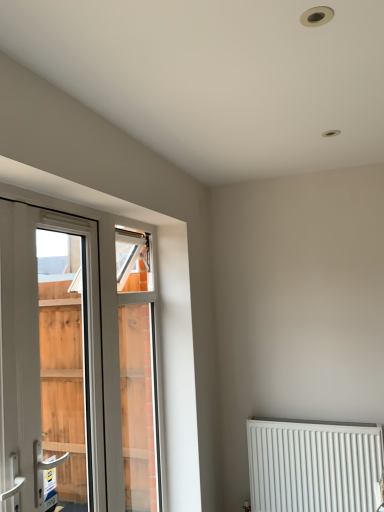
What do you see at coordinates (73, 368) in the screenshot? This screenshot has height=512, width=384. I see `white plastic window at left` at bounding box center [73, 368].

The image size is (384, 512). I want to click on white plastic window at left, so click(73, 368).

What is the approximate width of white plastic window at left?

The width of white plastic window at left is 4.58 inches.

What is the approximate width of white metal radiator at lower right?

white metal radiator at lower right is 5.27 inches wide.

Image resolution: width=384 pixels, height=512 pixels. In order to click on white metal radiator at lower right in this screenshot , I will do `click(313, 466)`.

Image resolution: width=384 pixels, height=512 pixels. What do you see at coordinates (313, 466) in the screenshot?
I see `white metal radiator at lower right` at bounding box center [313, 466].

What is the approximate height of white metal radiator at lower right?

26.43 inches.

The height and width of the screenshot is (512, 384). I want to click on white plastic window at left, so click(73, 368).

Which object is positioned more to the left, white metal radiator at lower right or white plastic window at left?

white plastic window at left is more to the left.

Is white metal radiator at lower right further to camera compared to white plastic window at left?

That is True.

Is point (260, 436) positioned in front of point (17, 372)?

That is False.

From the image's perspective, is white metal radiator at lower right located above white plastic window at left?

No, from the image's perspective, white metal radiator at lower right is not on top of white plastic window at left.

From a real-world perspective, is white metal radiator at lower right below white plastic window at left?

Indeed, from a real-world perspective, white metal radiator at lower right is positioned beneath white plastic window at left.

Considering the sizes of white metal radiator at lower right and white plastic window at left in the image, is white metal radiator at lower right wider or thinner than white plastic window at left?

In the image, white metal radiator at lower right appears to be wider than white plastic window at left.

Which of these two, white metal radiator at lower right or white plastic window at left, stands shorter?

With less height is white metal radiator at lower right.

In terms of size, does white metal radiator at lower right appear bigger or smaller than white plastic window at left?

Considering their sizes, white metal radiator at lower right takes up less space than white plastic window at left.

Which is correct: white metal radiator at lower right is inside white plastic window at left, or outside of it?

white metal radiator at lower right cannot be found inside white plastic window at left.

Is white metal radiator at lower right next to white plastic window at left and touching it?

No, white metal radiator at lower right is not beside white plastic window at left.

Does white metal radiator at lower right turn towards white plastic window at left?

No, white metal radiator at lower right is not turned towards white plastic window at left.

What are the coordinates of `radiator below the white plastic window at left (from a real-world perspective)` in the screenshot? It's located at (313, 466).

Is white plastic window at left to the right of white metal radiator at lower right from the viewer's perspective?

Incorrect, white plastic window at left is not on the right side of white metal radiator at lower right.

Considering the relative positions of white plastic window at left and white metal radiator at lower right in the image provided, is white plastic window at left behind white metal radiator at lower right?

No, white plastic window at left is closer to the viewer.

Which is nearer, (x=53, y=301) or (x=287, y=458)?

Point (x=53, y=301) is positioned farther from the camera compared to point (x=287, y=458).

From the image's perspective, which one is positioned higher, white plastic window at left or white metal radiator at lower right?

white plastic window at left appears higher in the image.

From a real-world perspective, is white plastic window at left below white metal radiator at lower right?

No, from a real-world perspective, white plastic window at left is not under white metal radiator at lower right.

Which object is thinner, white plastic window at left or white metal radiator at lower right?

Thinner between the two is white plastic window at left.

Can you confirm if white plastic window at left is taller than white metal radiator at lower right?

Yes.

Based on the photo, considering the sizes of white plastic window at left and white metal radiator at lower right in the image, is white plastic window at left bigger or smaller than white metal radiator at lower right?

Clearly, white plastic window at left is larger in size than white metal radiator at lower right.

Is white plastic window at left surrounding white metal radiator at lower right?

No, white metal radiator at lower right is located outside of white plastic window at left.

Is white plastic window at left not close to white metal radiator at lower right?

Absolutely, white plastic window at left is distant from white metal radiator at lower right.

Is white plastic window at left oriented away from white metal radiator at lower right?

That's not correct — white plastic window at left is not looking away from white metal radiator at lower right.

How different are the orientations of white plastic window at left and white metal radiator at lower right in degrees?

There is a 90-degree angle between the facing directions of white plastic window at left and white metal radiator at lower right.

Find the location of a particular element. radiator below the white plastic window at left (from the image's perspective) is located at coordinates (313, 466).

Find the location of a particular element. Image resolution: width=384 pixels, height=512 pixels. window above the white metal radiator at lower right (from a real-world perspective) is located at coordinates (73, 368).

The height and width of the screenshot is (512, 384). In order to click on window above the white metal radiator at lower right (from the image's perspective) in this screenshot , I will do `click(73, 368)`.